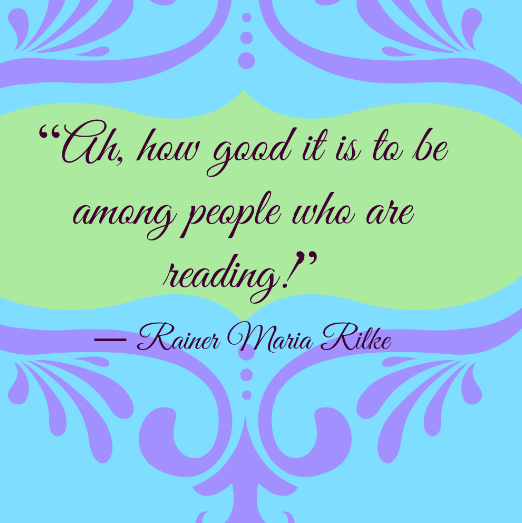
Identify the location of purple decorative image in background. (212, 386).